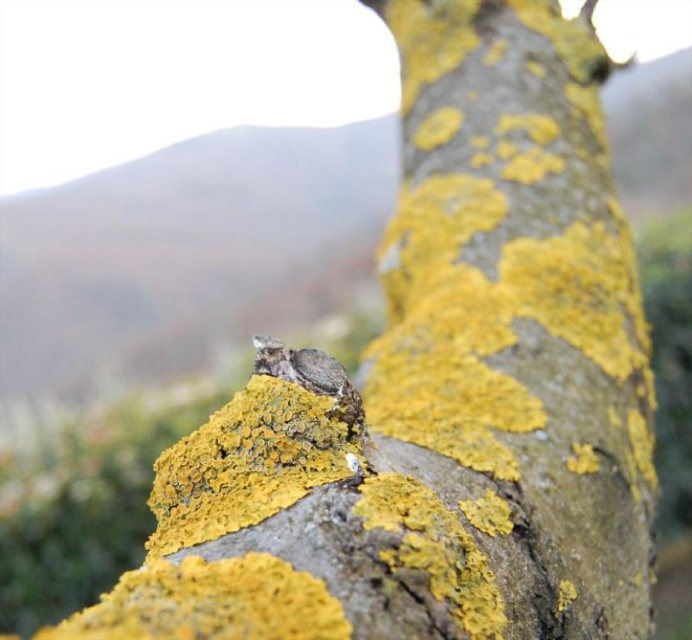
You are examining the tree trunk covered in yellow lichen. There are two points marked on the trunk, one at coordinates point (527, 540) and another at point (282, 342). Which of these points is nearer to you?

Point (527, 540) is closer to the viewer than point (282, 342).

You are standing 5 feet away from the tree trunk. If you want to get a closer look at the point labeled as point (480,480) on the tree trunk, how much closer should you move to be exactly at the point?

The distance of point (480,480) from camera is 3.37 feet. Since you are currently 5 feet away, you need to move 1.63 feet closer to reach the point.